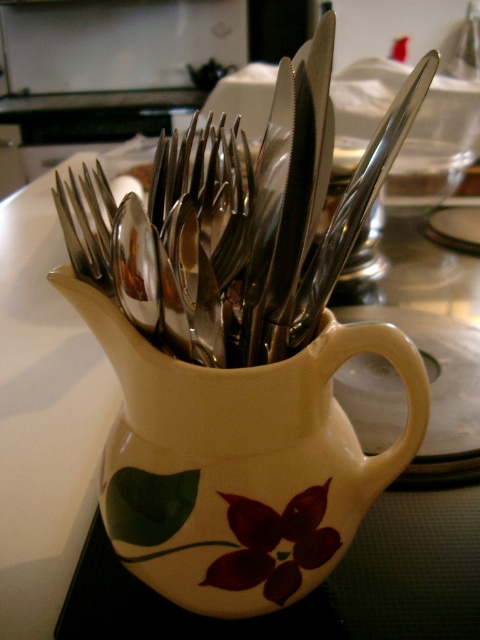
You are setting the table and need to place the satin silver knife at upper center and the satin silver fork at center. According to the image, which one should you place first if you want to follow the arrangement from left to right?

The satin silver fork at center should be placed first since it is positioned to the left of the satin silver knife at upper center when arranging from left to right.

You are setting up a table for a small dinner party and have the white ceramic jug at center and the satin silver fork at center on the counter. Which object takes up more horizontal space?

The white ceramic jug at center has a greater width than the satin silver fork at center, so it takes up more horizontal space.

You are organizing the kitchen and need to place a new spice jar that is 4 inches in diameter. You see the white ceramic jug at center and the satin silver knife at upper center. Can you fit the spice jar between them?

The white ceramic jug at center is 3.59 inches away from the satin silver knife at upper center. Since the spice jar is 4 inches in diameter, it would not fit between them as the distance is smaller than the jar.